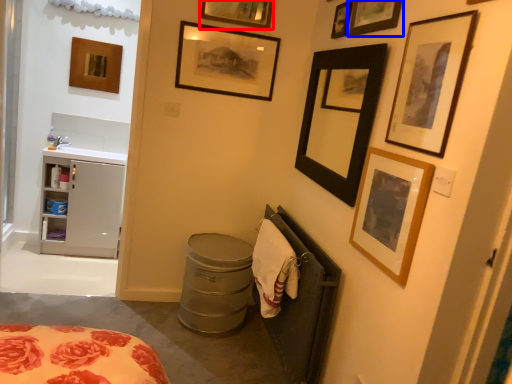
Question: Among these objects, which one is nearest to the camera, picture frame (highlighted by a red box) or picture frame (highlighted by a blue box)?

Choices:
 (A) picture frame
 (B) picture frame

Answer: (B)